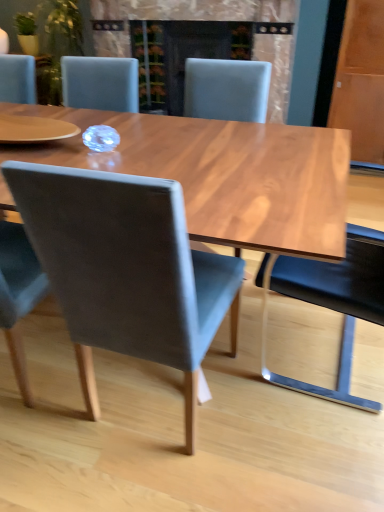
Question: Is black leather chair at right, which ranks as the 1th chair in right-to-left order, further to camera compared to matte black fireplace at center?

Choices:
 (A) yes
 (B) no

Answer: (B)

Question: Could you tell me if black leather chair at right, which is the 4th chair from left to right, is facing matte black fireplace at center?

Choices:
 (A) no
 (B) yes

Answer: (A)

Question: Does black leather chair at right, which is the 4th chair from left to right, appear on the right side of matte black fireplace at center?

Choices:
 (A) yes
 (B) no

Answer: (A)

Question: Is black leather chair at right, which ranks as the 1th chair in right-to-left order, smaller than matte black fireplace at center?

Choices:
 (A) yes
 (B) no

Answer: (A)

Question: Are black leather chair at right, which is the 4th chair from left to right, and matte black fireplace at center making contact?

Choices:
 (A) yes
 (B) no

Answer: (B)

Question: Would you say velvet grey chair at center, the second chair viewed from the left, is inside or outside matte gray chair at center, the 3th chair positioned from the left?

Choices:
 (A) inside
 (B) outside

Answer: (B)

Question: Considering the positions of velvet grey chair at center, the second chair viewed from the left, and matte gray chair at center, the 3th chair positioned from the left, in the image, is velvet grey chair at center, the second chair viewed from the left, bigger or smaller than matte gray chair at center, the 3th chair positioned from the left,?

Choices:
 (A) small
 (B) big

Answer: (A)

Question: From a real-world perspective, relative to matte gray chair at center, the 3th chair positioned from the left, is velvet grey chair at center, the second chair viewed from the left, vertically above or below?

Choices:
 (A) above
 (B) below

Answer: (A)

Question: Considering the positions of point (167, 230) and point (246, 104), is point (167, 230) closer or farther from the camera than point (246, 104)?

Choices:
 (A) closer
 (B) farther

Answer: (A)

Question: From a real-world perspective, is velvet grey chair at center, which is counted as the 3th chair, starting from the right, above or below matte gray chair at center, the 4th chair from the right?

Choices:
 (A) below
 (B) above

Answer: (A)

Question: In terms of size, does velvet grey chair at center, the second chair viewed from the left, appear bigger or smaller than matte gray chair at center, which is the first chair from left to right?

Choices:
 (A) big
 (B) small

Answer: (A)

Question: Is point (215, 329) closer or farther from the camera than point (97, 397)?

Choices:
 (A) farther
 (B) closer

Answer: (B)

Question: Is velvet grey chair at center, the second chair viewed from the left, spatially inside matte gray chair at center, the 4th chair from the right, or outside of it?

Choices:
 (A) inside
 (B) outside

Answer: (B)

Question: Is point (198, 81) closer or farther from the camera than point (349, 333)?

Choices:
 (A) closer
 (B) farther

Answer: (B)

Question: From a real-world perspective, is matte gray chair at center, the second chair viewed from the right, above or below black leather chair at right, which ranks as the 1th chair in right-to-left order?

Choices:
 (A) below
 (B) above

Answer: (B)